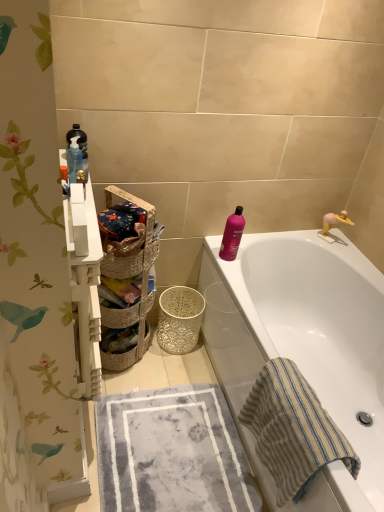
Identify the location of blank area beneath gray textured towel at lower center, which is the 1th beach towel in left-to-right order (from a real-world perspective). This screenshot has height=512, width=384. (173, 478).